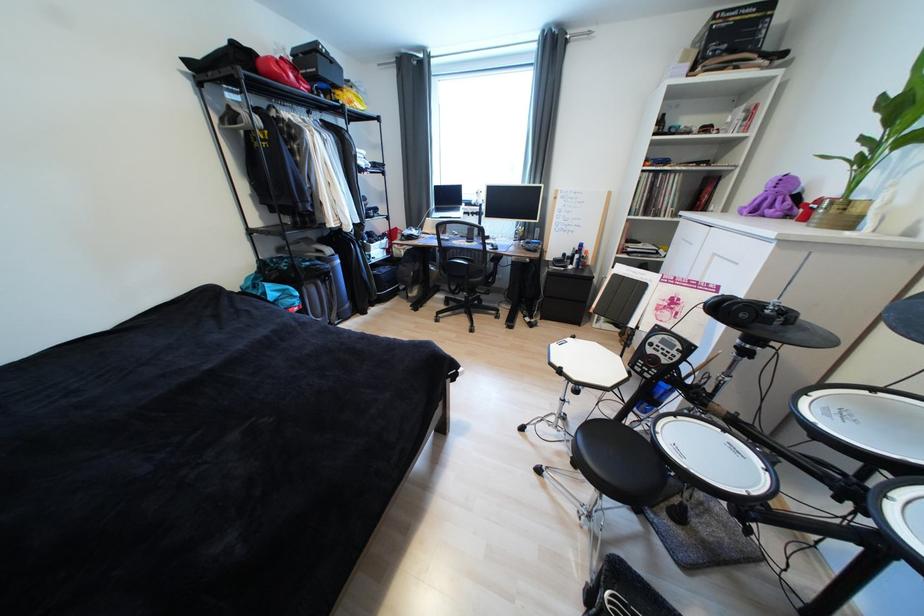
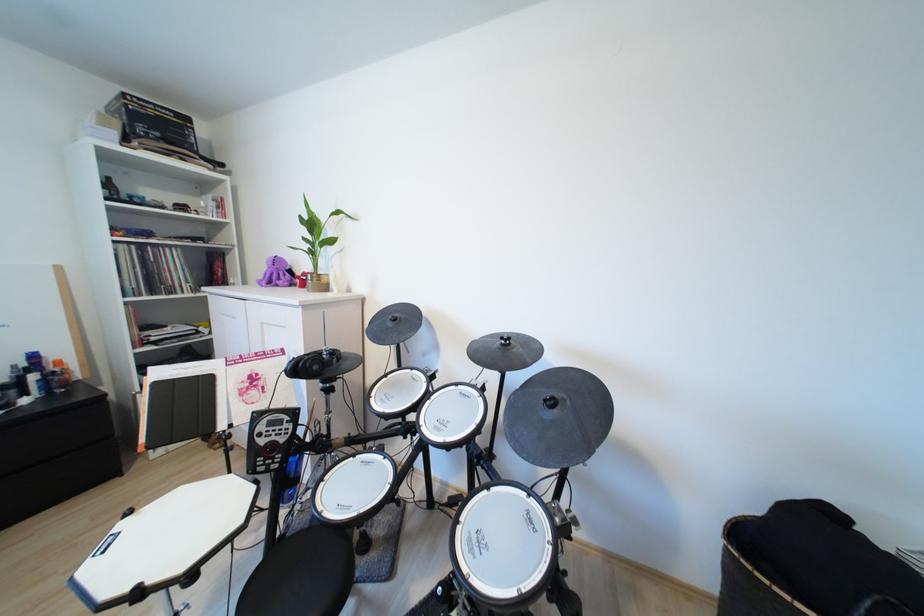
In the second image, find the point that corresponds to point (662, 434) in the first image.

(326, 515)